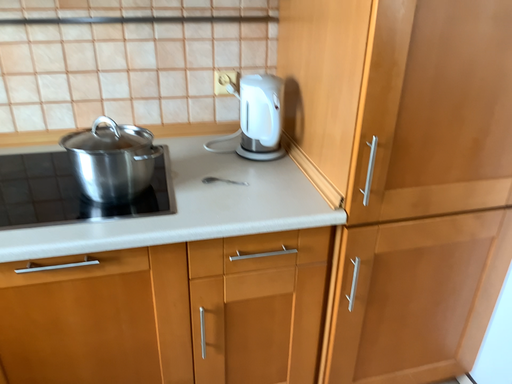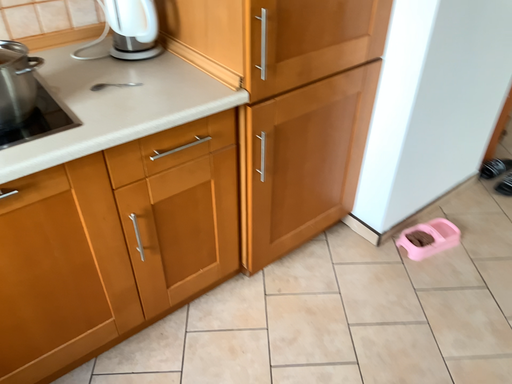
Question: How did the camera likely rotate when shooting the video?

Choices:
 (A) rotated downward
 (B) rotated upward

Answer: (A)